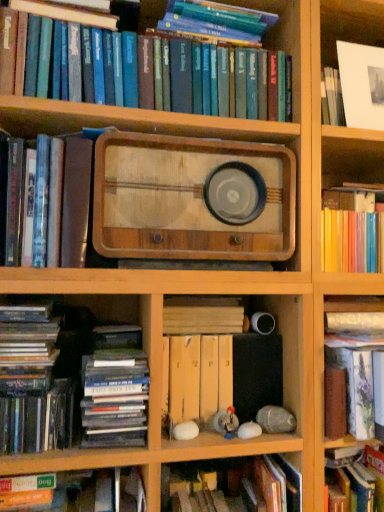
Question: Is white paper at upper right at the back of wooden radio at center?

Choices:
 (A) no
 (B) yes

Answer: (A)

Question: Is white paper at upper right inside wooden radio at center?

Choices:
 (A) no
 (B) yes

Answer: (A)

Question: Could you tell me if wooden radio at center is facing white paper at upper right?

Choices:
 (A) yes
 (B) no

Answer: (B)

Question: Is the position of wooden radio at center more distant than that of white paper at upper right?

Choices:
 (A) no
 (B) yes

Answer: (A)

Question: Does wooden radio at center have a larger size compared to white paper at upper right?

Choices:
 (A) yes
 (B) no

Answer: (A)

Question: Is wooden radio at center positioned in front of white paper at upper right?

Choices:
 (A) no
 (B) yes

Answer: (B)

Question: Considering the relative positions of hardcover book at left, placed as the 2th book when sorted from top to bottom, and hardcover books at upper center, placed as the ninth book when sorted from bottom to top, in the image provided, is hardcover book at left, placed as the 2th book when sorted from top to bottom, to the left of hardcover books at upper center, placed as the ninth book when sorted from bottom to top, from the viewer's perspective?

Choices:
 (A) yes
 (B) no

Answer: (A)

Question: Is hardcover book at left, positioned as the eighth book in bottom-to-top order, in front of hardcover books at upper center, which is the first book in top-to-bottom order?

Choices:
 (A) yes
 (B) no

Answer: (A)

Question: From the image's perspective, would you say hardcover book at left, placed as the 2th book when sorted from top to bottom, is positioned over hardcover books at upper center, placed as the ninth book when sorted from bottom to top?

Choices:
 (A) no
 (B) yes

Answer: (A)

Question: Is hardcover book at left, positioned as the eighth book in bottom-to-top order, directly adjacent to hardcover books at upper center, placed as the ninth book when sorted from bottom to top?

Choices:
 (A) no
 (B) yes

Answer: (A)

Question: Does hardcover book at left, placed as the 2th book when sorted from top to bottom, turn towards hardcover books at upper center, which is the first book in top-to-bottom order?

Choices:
 (A) no
 (B) yes

Answer: (A)

Question: Considering the relative sizes of hardcover book at left, placed as the 2th book when sorted from top to bottom, and hardcover books at upper center, which is the first book in top-to-bottom order, in the image provided, is hardcover book at left, placed as the 2th book when sorted from top to bottom, shorter than hardcover books at upper center, which is the first book in top-to-bottom order,?

Choices:
 (A) yes
 (B) no

Answer: (B)

Question: Could you tell me if yellow cardboard file at center, the fourth book when ordered from bottom to top, is turned towards hardcover books at upper center, which is the first book in top-to-bottom order?

Choices:
 (A) no
 (B) yes

Answer: (A)